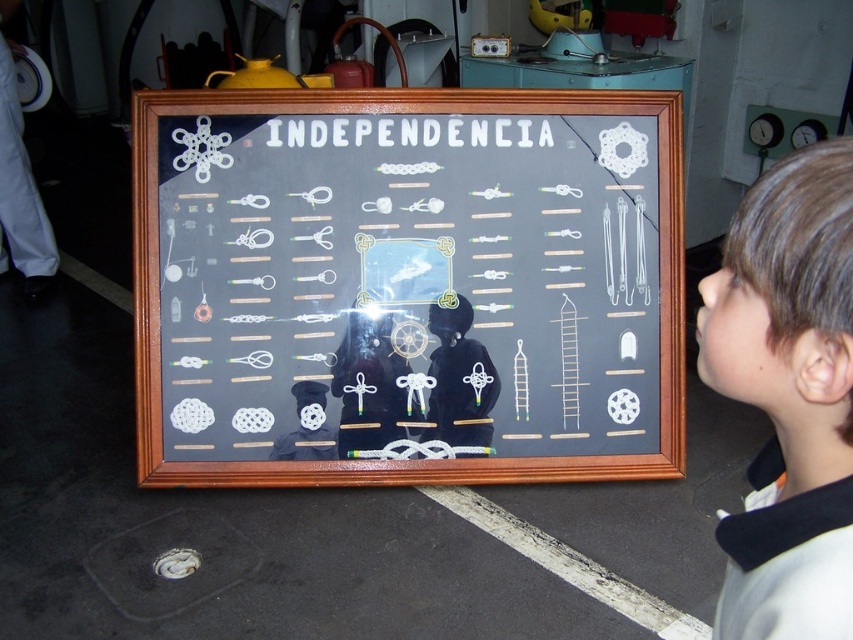
You are an observer looking at the framed display board. You notice the white paper at center and the brown hair at upper right. Which object is wider?

The white paper at center is wider than the brown hair at upper right.

You are standing in front of the framed display board and notice two points marked on it. The first point is at coordinate point [343,180] and the second is at point [751,509]. Which point is closer to you?

Point [343,180] is behind point [751,509], so the point closer to you is point [751,509].